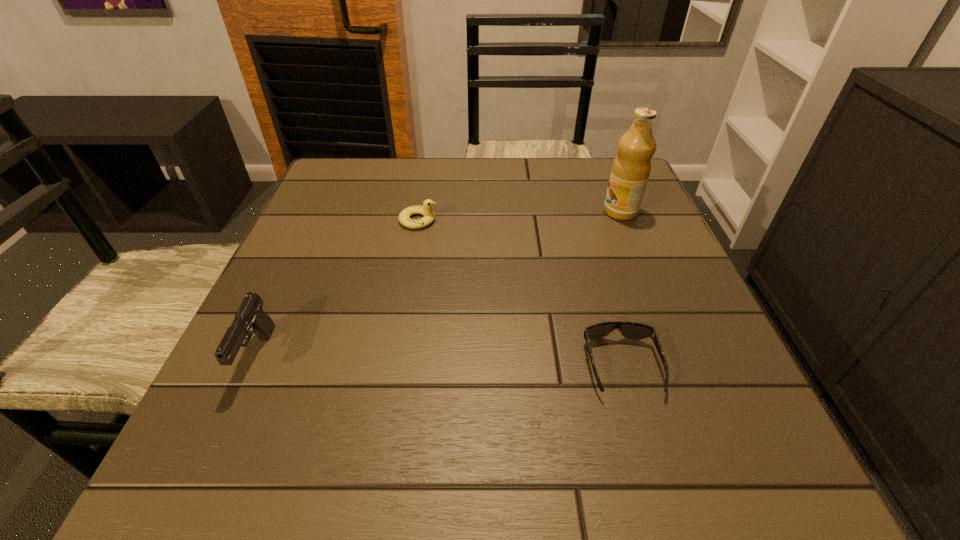
Locate an element on the screen. free space at the right edge is located at coordinates (590, 213).

What are the coordinates of `vacant space at the far left corner of the desktop` in the screenshot? It's located at (356, 204).

The image size is (960, 540). In order to click on free spot at the near left corner of the desktop in this screenshot , I will do `click(174, 469)`.

At what (x,y) coordinates should I click in order to perform the action: click on free space at the far right corner. Please return your answer as a coordinate pair (x, y). The height and width of the screenshot is (540, 960). Looking at the image, I should click on (585, 176).

In order to click on free point between the third tallest object and the sunglasses in this screenshot , I will do `click(520, 293)`.

I want to click on free space between the pistol and the olive oil, so click(x=440, y=284).

I want to click on free space between the pistol and the olive oil, so click(x=440, y=284).

Identify the location of blank region between the sunglasses and the pistol. The height and width of the screenshot is (540, 960). (x=440, y=361).

The image size is (960, 540). I want to click on vacant area that lies between the pistol and the third object from right to left, so click(x=338, y=288).

Locate an element on the screen. The width and height of the screenshot is (960, 540). empty location between the shortest object and the olive oil is located at coordinates (621, 289).